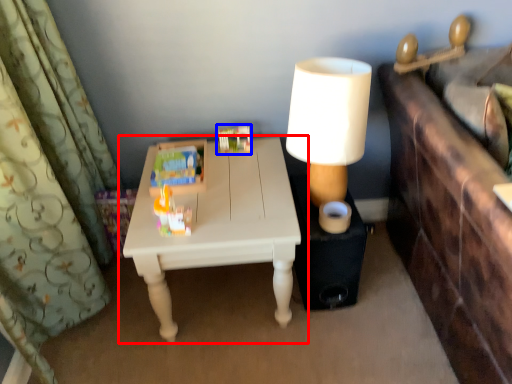
Question: Which object appears farthest to the camera in this image, table (highlighted by a red box) or toy (highlighted by a blue box)?

Choices:
 (A) table
 (B) toy

Answer: (B)